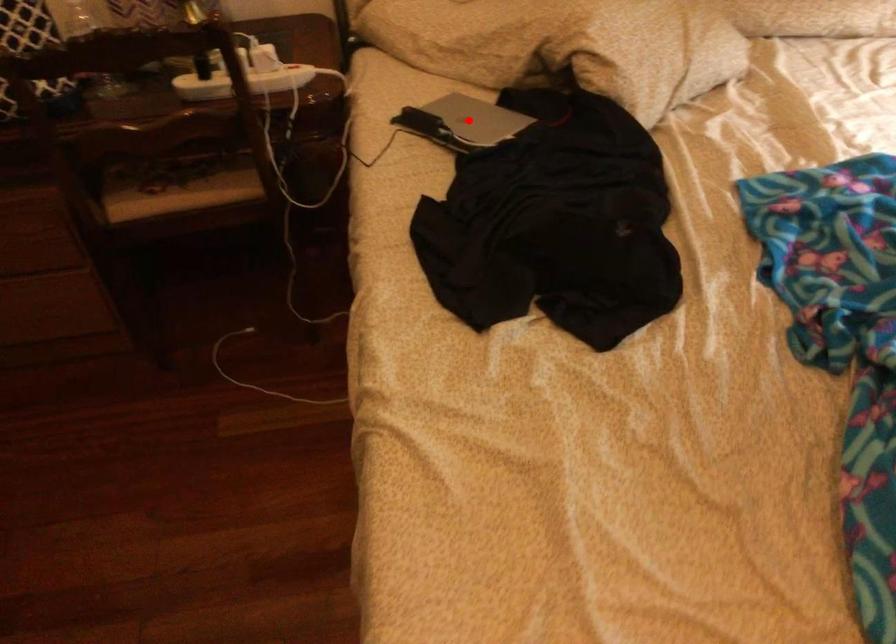
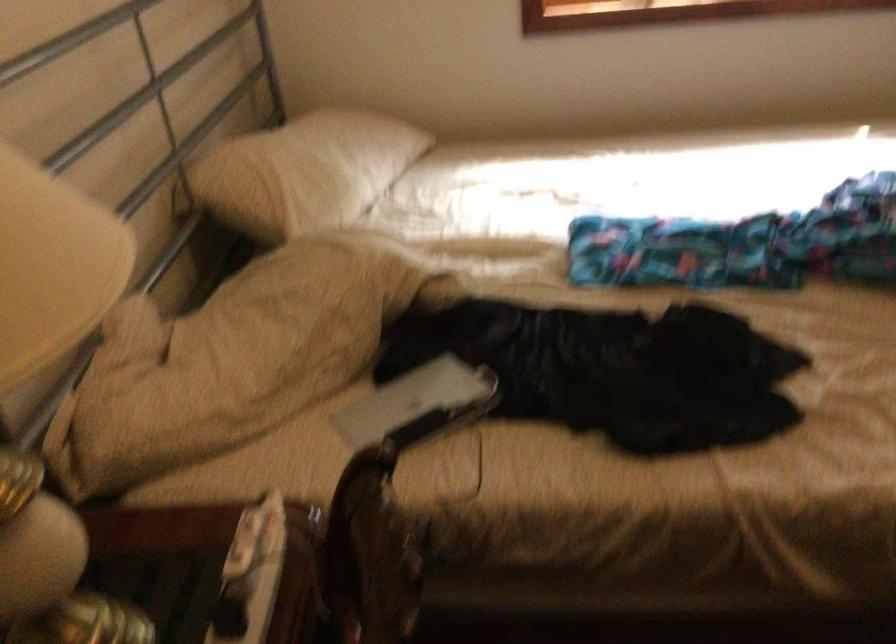
Find the pixel in the second image that matches the highlighted location in the first image.

(418, 404)